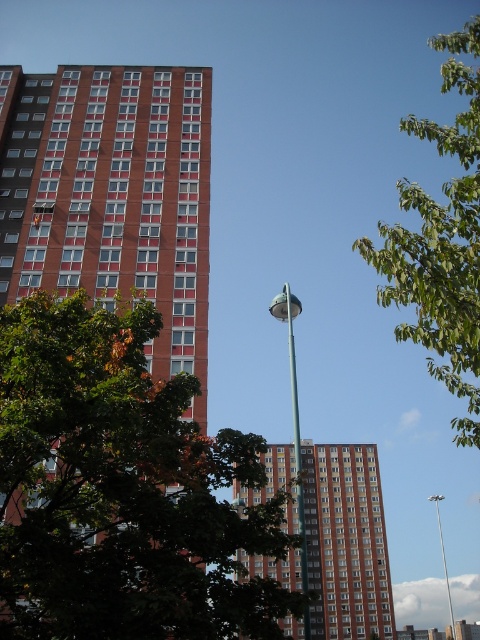
Does green leafy tree at upper right appear under brown brick building at center?

Actually, green leafy tree at upper right is above brown brick building at center.

Does point (478, 131) come closer to viewer compared to point (358, 614)?

Yes, it is in front of point (358, 614).

Identify the location of green leafy tree at upper right. This screenshot has height=640, width=480. (442, 241).

Does point (228, 586) come in front of point (282, 301)?

Yes, point (228, 586) is closer to viewer.

Locate an element on the screen. This screenshot has height=640, width=480. green leafy tree at center is located at coordinates (120, 490).

Locate an element on the screen. The height and width of the screenshot is (640, 480). green leafy tree at center is located at coordinates (120, 490).

Looking at this image, is brown brick building at center above satin silver pole at center?

Actually, brown brick building at center is below satin silver pole at center.

Is the position of brown brick building at center less distant than that of satin silver pole at center?

Yes, it is.

Which is behind, point (363, 522) or point (297, 444)?

Point (363, 522)

Where is `brown brick building at center`? The height and width of the screenshot is (640, 480). brown brick building at center is located at coordinates (346, 541).